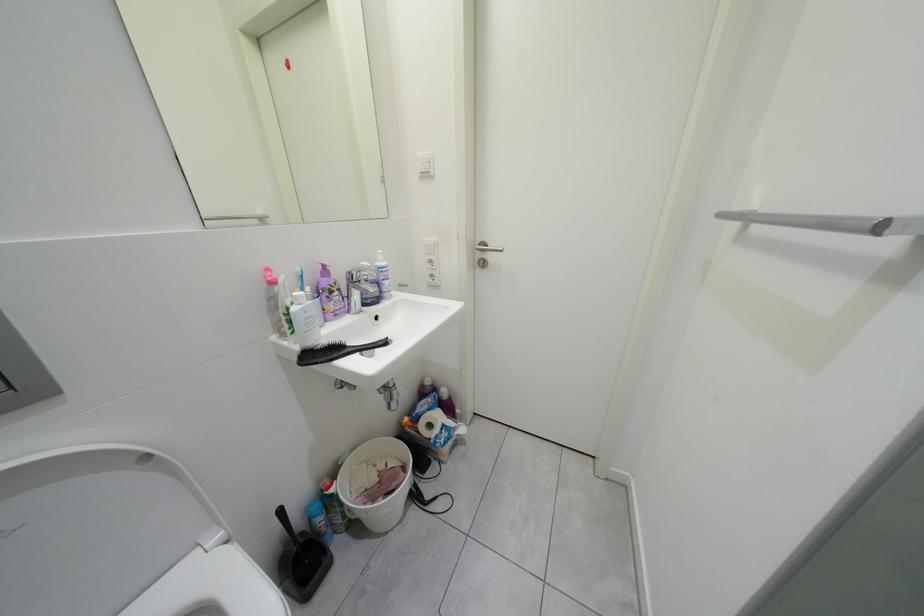
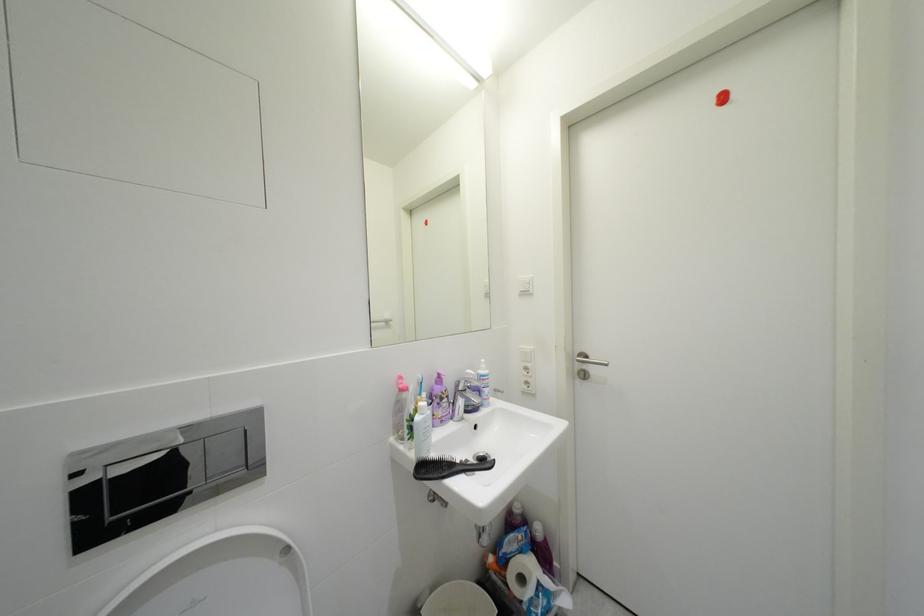
In a continuous first-person perspective shot, in which direction is the camera moving?

The cameraman moved toward left, backward.